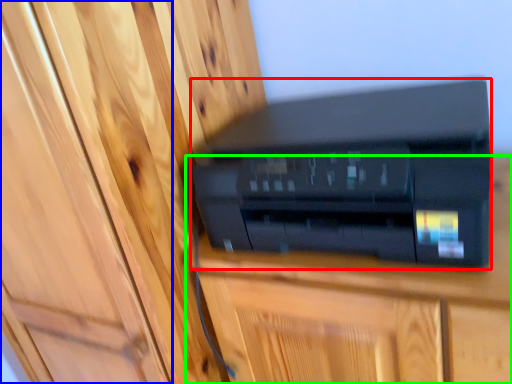
Question: Which object is the farthest from printer (highlighted by a red box)? Choose among these: door (highlighted by a blue box) or furniture (highlighted by a green box).

Choices:
 (A) door
 (B) furniture

Answer: (A)